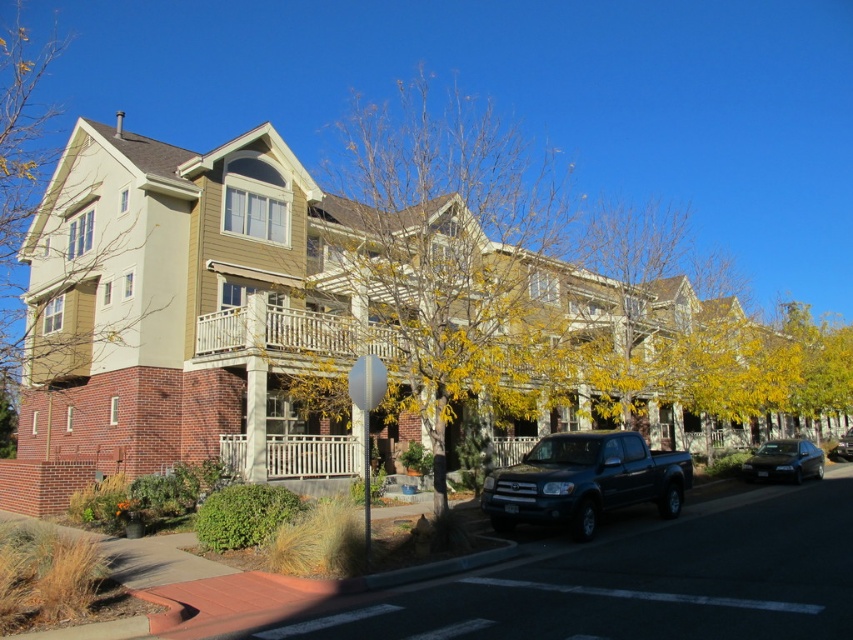
You are standing at the stop sign on the corner of the street. You see two points marked in the scene. Which point is closer to you? The points are labeled as point 1 at coordinates (425, 157) and point 2 at coordinates (300, 621). Please answer based on their positions relative to your viewpoint.

Point 2 at coordinates (300, 621) is closer to you because point 1 at coordinates (425, 157) is behind it.

You are standing at the camera position and want to take a photo of the yellow leafy tree at center. If your camera has a maximum focus range of 10 meters, will it be able to capture the tree clearly?

The yellow leafy tree at center is 11.10 meters from camera, which exceeds the camera maximum focus range of 10 meters. Therefore, the camera cannot capture the tree clearly.